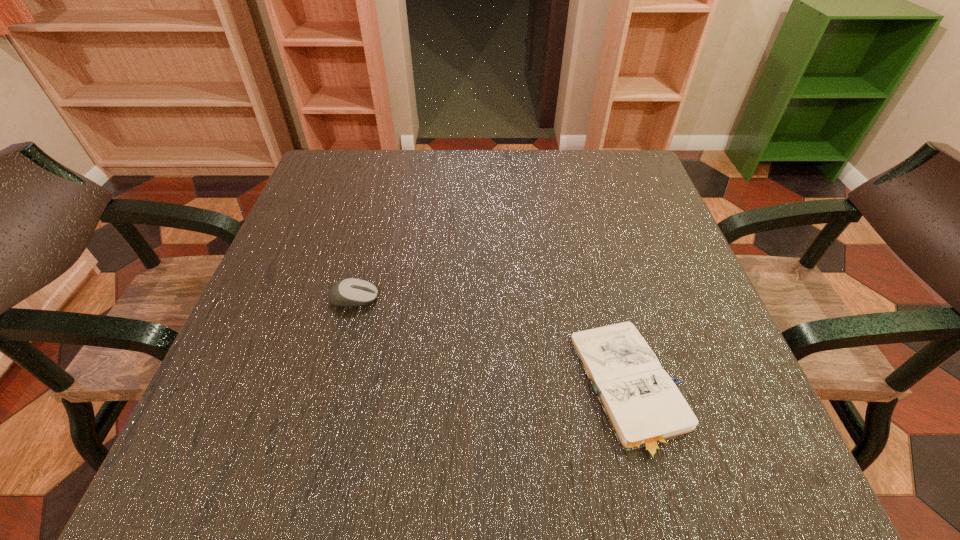
This screenshot has height=540, width=960. Identify the location of free space in the image that satisfies the following two spatial constraints: 1. on the wheel side of the computer equipment; 2. on the back side of the shorter object. (330, 389).

What are the coordinates of `free location that satisfies the following two spatial constraints: 1. on the back side of the shorter object; 2. on the wheel side of the left object` in the screenshot? It's located at (608, 298).

You are a GUI agent. You are given a task and a screenshot of the screen. Output one action in this format:
    pyautogui.click(x=<x>, y=<y>)
    Task: Click on the free space that satisfies the following two spatial constraints: 1. on the wheel side of the right object; 2. on the left side of the computer equipment
    The image size is (960, 540).
    Given the screenshot: What is the action you would take?
    (330, 389)

You are a GUI agent. You are given a task and a screenshot of the screen. Output one action in this format:
    pyautogui.click(x=<x>, y=<y>)
    Task: Click on the vacant area that satisfies the following two spatial constraints: 1. on the wheel side of the left object; 2. on the back side of the shorter object
    This screenshot has height=540, width=960.
    Given the screenshot: What is the action you would take?
    pyautogui.click(x=330, y=389)

You are a GUI agent. You are given a task and a screenshot of the screen. Output one action in this format:
    pyautogui.click(x=<x>, y=<y>)
    Task: Click on the vacant region that satisfies the following two spatial constraints: 1. on the wheel side of the notebook; 2. on the right side of the computer equipment
    
    Given the screenshot: What is the action you would take?
    pyautogui.click(x=330, y=389)

Where is `vacant position in the image that satisfies the following two spatial constraints: 1. on the back side of the shorter object; 2. on the wheel side of the farther object`? This screenshot has height=540, width=960. vacant position in the image that satisfies the following two spatial constraints: 1. on the back side of the shorter object; 2. on the wheel side of the farther object is located at coordinates (608, 298).

The height and width of the screenshot is (540, 960). I want to click on free spot that satisfies the following two spatial constraints: 1. on the back side of the shorter object; 2. on the wheel side of the farther object, so click(608, 298).

The width and height of the screenshot is (960, 540). Identify the location of free region that satisfies the following two spatial constraints: 1. on the wheel side of the right object; 2. on the right side of the computer equipment. (330, 389).

Where is `free space in the image that satisfies the following two spatial constraints: 1. on the wheel side of the computer equipment; 2. on the left side of the right object`? free space in the image that satisfies the following two spatial constraints: 1. on the wheel side of the computer equipment; 2. on the left side of the right object is located at coordinates click(330, 389).

You are a GUI agent. You are given a task and a screenshot of the screen. Output one action in this format:
    pyautogui.click(x=<x>, y=<y>)
    Task: Click on the free space that satisfies the following two spatial constraints: 1. on the wheel side of the computer equipment; 2. on the left side of the notebook
    The width and height of the screenshot is (960, 540).
    Given the screenshot: What is the action you would take?
    pyautogui.click(x=330, y=389)